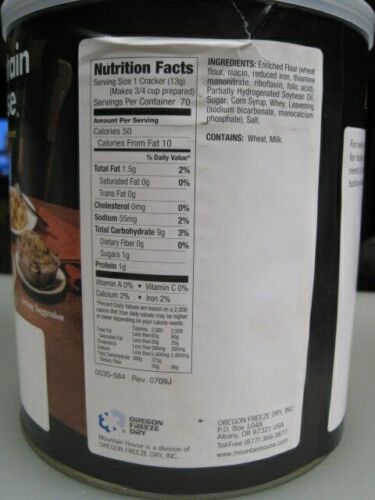
Identify the location of surface. (368, 467).